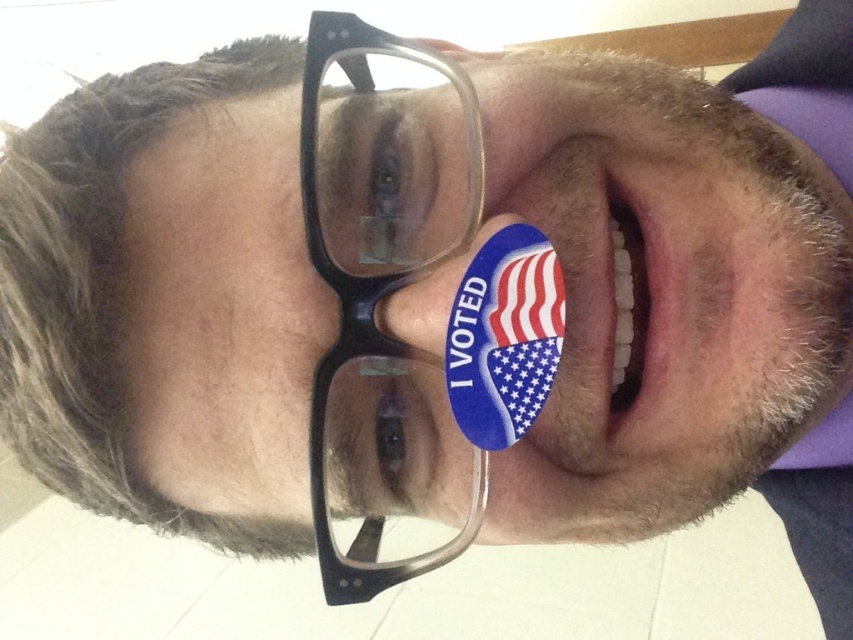
From the picture: You are a photographer trying to capture a close up of the person in the image. The black plastic glasses at center is represented by point [380,243]. Where should you focus your camera to ensure the black plastic glasses at center is in focus?

The black plastic glasses at center is represented by point [380,243], so you should focus your camera at point [380,243] to ensure it is in focus.

You are a photographer who wants to ensure that both the black plastic glasses at center and the blue matte sticker at lower center are clearly visible in the photo. Based on their positions, which object might partially obscure the other?

The black plastic glasses at center is positioned over the blue matte sticker at lower center, so the glasses might partially obscure the sticker.